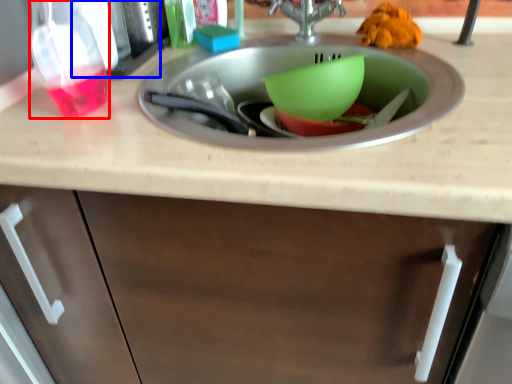
Question: Which of the following is the closest to the observer, bottle (highlighted by a red box) or appliance (highlighted by a blue box)?

Choices:
 (A) bottle
 (B) appliance

Answer: (A)